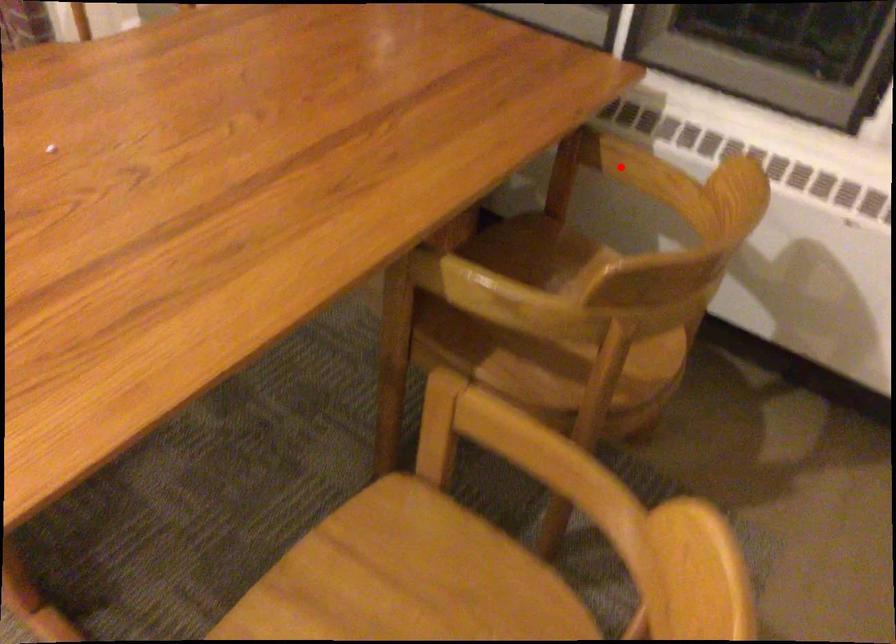
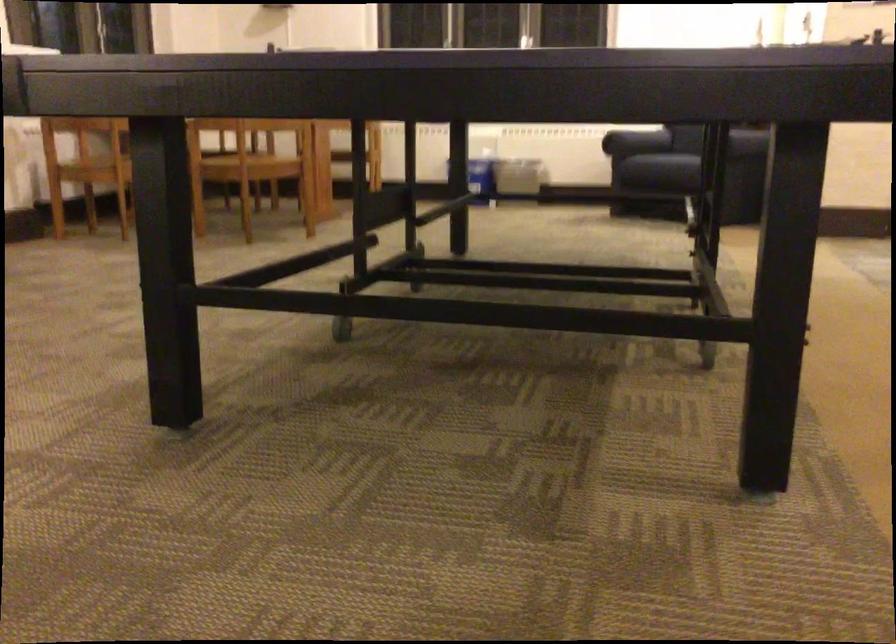
Question: I am providing you with two images of the same scene from different viewpoints. A red point is marked on the first image. At the location where the point appears in image 1, is it still visible in image 2?

Choices:
 (A) Yes
 (B) No

Answer: (B)